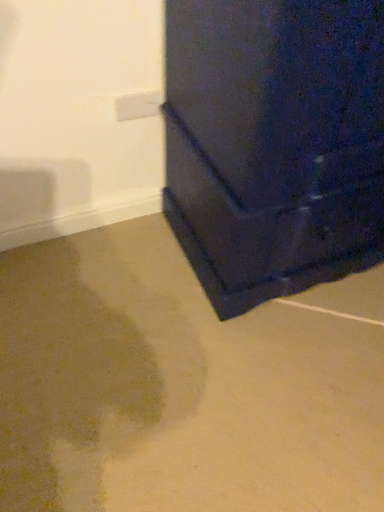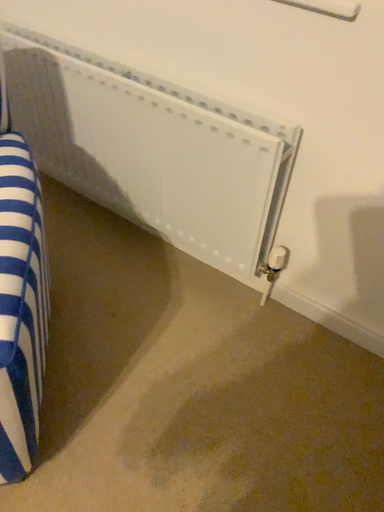
Question: Which way did the camera rotate in the video?

Choices:
 (A) rotated downward
 (B) rotated upward

Answer: (B)